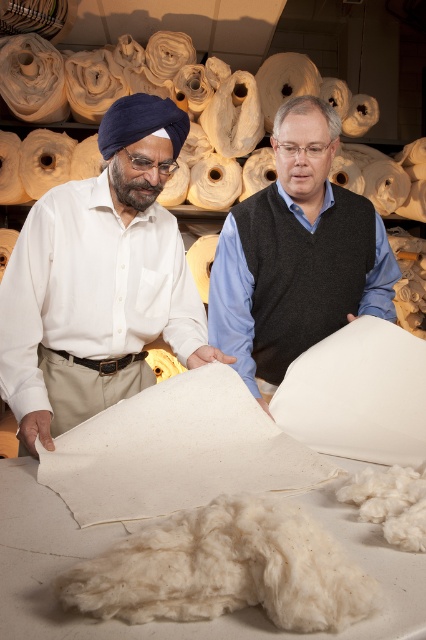
Question: Among these objects, which one is farthest from the camera?

Choices:
 (A) white matte fabric at left
 (B) matte white fabric at center

Answer: (B)

Question: Can you confirm if white matte fabric at left is positioned to the right of matte white fabric at center?

Choices:
 (A) yes
 (B) no

Answer: (B)

Question: Among these points, which one is nearest to the camera?

Choices:
 (A) (100, 218)
 (B) (339, 291)

Answer: (A)

Question: Does white matte fabric at left appear on the right side of matte white fabric at center?

Choices:
 (A) no
 (B) yes

Answer: (A)

Question: Which of the following is the farthest from the observer?

Choices:
 (A) (270, 189)
 (B) (123, 108)

Answer: (A)

Question: Does white matte fabric at left have a greater width compared to matte white fabric at center?

Choices:
 (A) no
 (B) yes

Answer: (A)